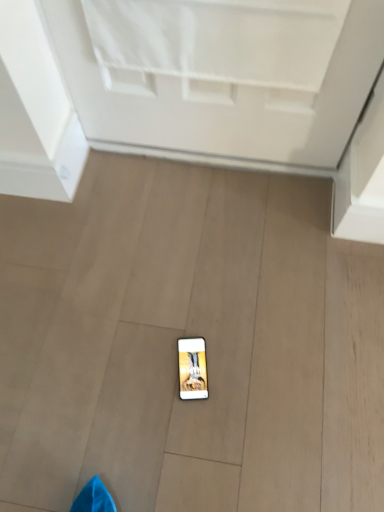
Identify the location of free point behind matte black phone at center. (188, 308).